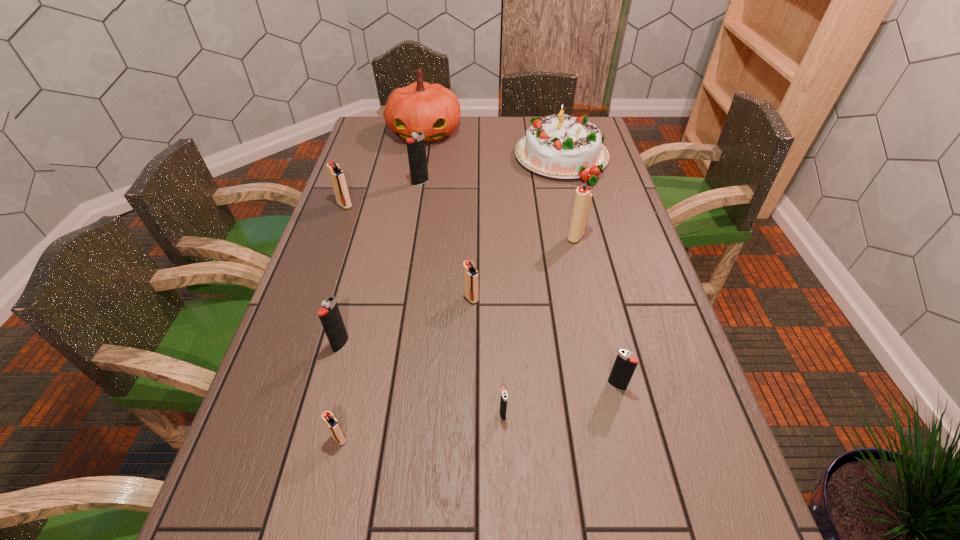
Where is `free spot located on the front of the cake`? The image size is (960, 540). free spot located on the front of the cake is located at coordinates (576, 216).

Find the location of `free location located on the back of the fifth farthest object`. free location located on the back of the fifth farthest object is located at coordinates (568, 204).

I want to click on vacant space located on the left of the biggest black igniter, so click(347, 183).

Identify the location of free space located on the front of the leftmost igniter. This screenshot has height=540, width=960. (326, 259).

Image resolution: width=960 pixels, height=540 pixels. Find the location of `vacant area situated on the back of the fourth nearest igniter`. vacant area situated on the back of the fourth nearest igniter is located at coordinates (369, 241).

You are a GUI agent. You are given a task and a screenshot of the screen. Output one action in this format:
    pyautogui.click(x=<x>, y=<y>)
    Task: Click on the vacant space located 0.370m on the left of the eighth farthest object
    
    Given the screenshot: What is the action you would take?
    pyautogui.click(x=437, y=386)

Locate an element on the screen. The width and height of the screenshot is (960, 540). free space located 0.090m on the right of the fourth farthest igniter is located at coordinates (514, 298).

The width and height of the screenshot is (960, 540). In order to click on vacant area situated 0.110m on the right of the second red igniter from left to right in this screenshot , I will do `click(403, 438)`.

I want to click on vacant region located on the right of the second nearest object, so click(x=569, y=414).

Identify the location of pumpkin that is positioned at the far edge. The width and height of the screenshot is (960, 540). (432, 109).